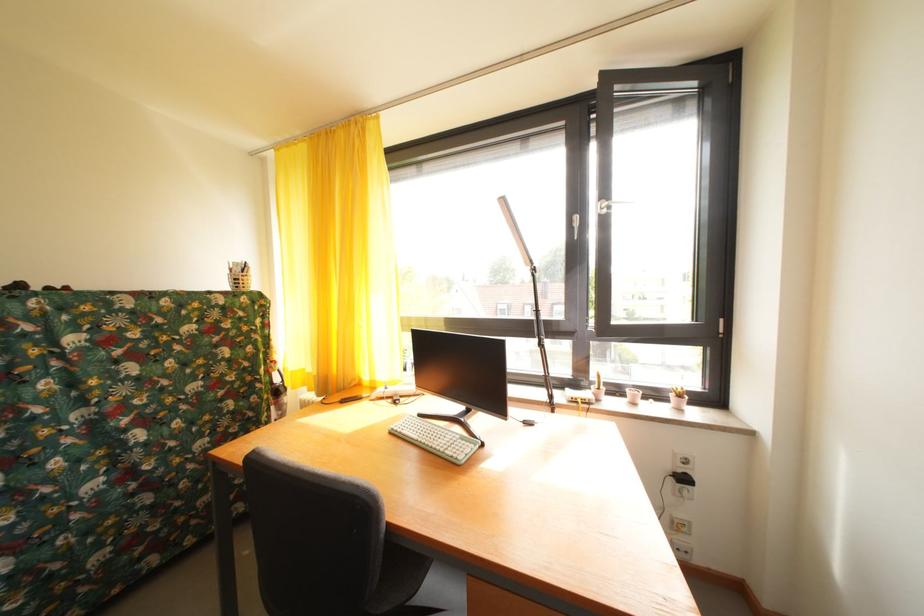
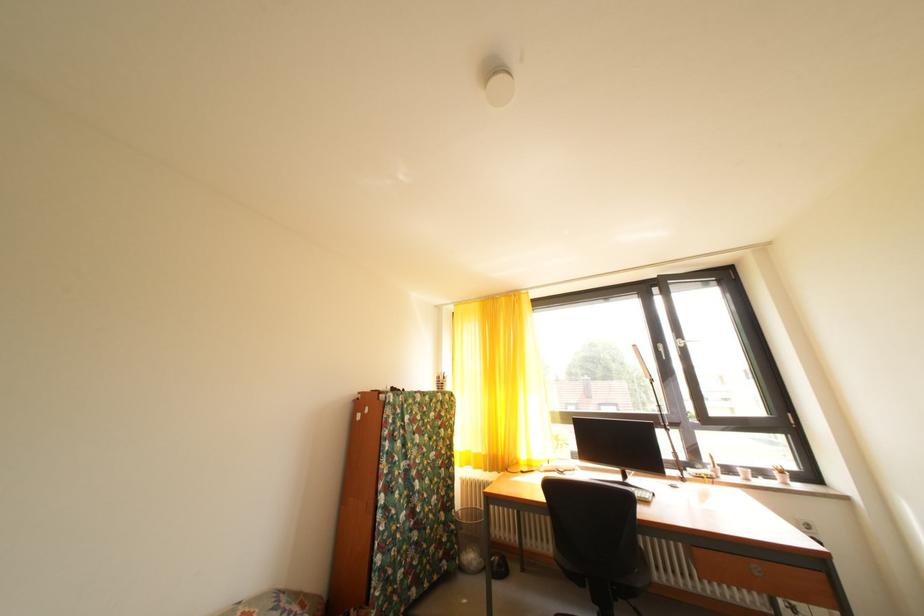
Which direction would the cameraman need to move to produce the second image?

The movement direction of the cameraman is left, backward.